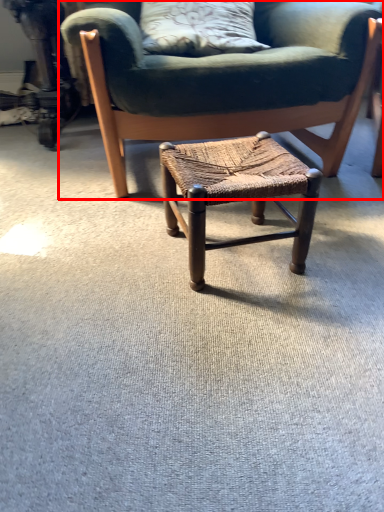
Question: Considering the relative positions of chair (annotated by the red box) and stool in the image provided, where is chair (annotated by the red box) located with respect to the staircase?

Choices:
 (A) left
 (B) right

Answer: (A)